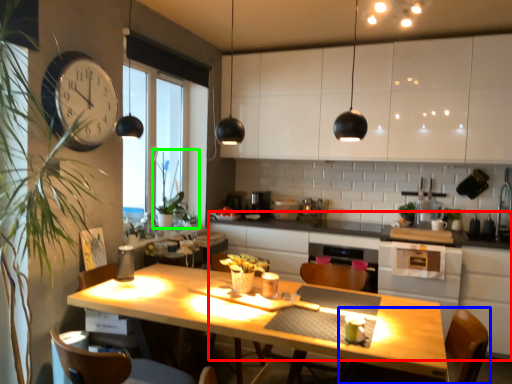
Question: Which object is positioned farthest from counter (highlighted by a red box)? Select from chair (highlighted by a blue box) and plant (highlighted by a green box).

Choices:
 (A) chair
 (B) plant

Answer: (A)